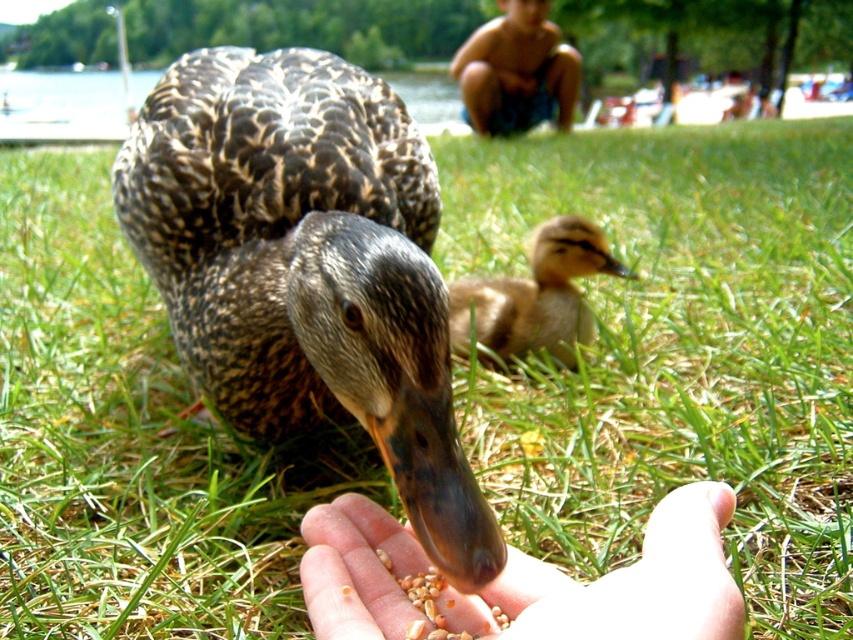
Question: Based on their relative distances, which object is farther from the brown speckled duck at center?

Choices:
 (A) brown downy duckling at center
 (B) blurred skin boy at upper center
 (C) skinny human hand at center

Answer: (B)

Question: Can you confirm if skinny human hand at center is positioned to the left of blurred skin boy at upper center?

Choices:
 (A) no
 (B) yes

Answer: (B)

Question: Is the position of brown speckled duck at center less distant than that of blurred skin boy at upper center?

Choices:
 (A) no
 (B) yes

Answer: (B)

Question: Which of the following is the closest to the observer?

Choices:
 (A) brown downy duckling at center
 (B) skinny human hand at center

Answer: (B)

Question: Is brown downy duckling at center to the right of blurred skin boy at upper center from the viewer's perspective?

Choices:
 (A) yes
 (B) no

Answer: (B)

Question: Which of the following is the farthest from the observer?

Choices:
 (A) (491, 102)
 (B) (654, 525)

Answer: (A)